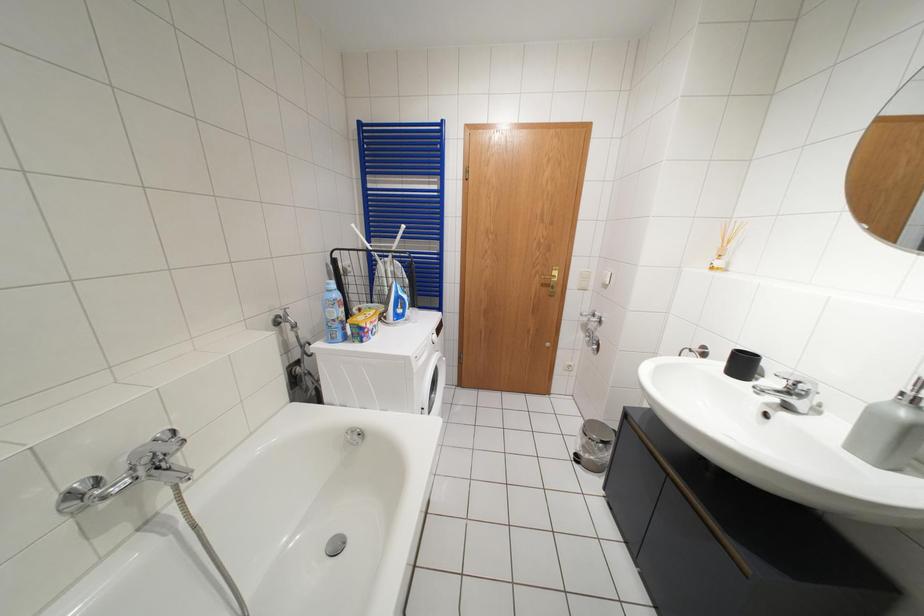
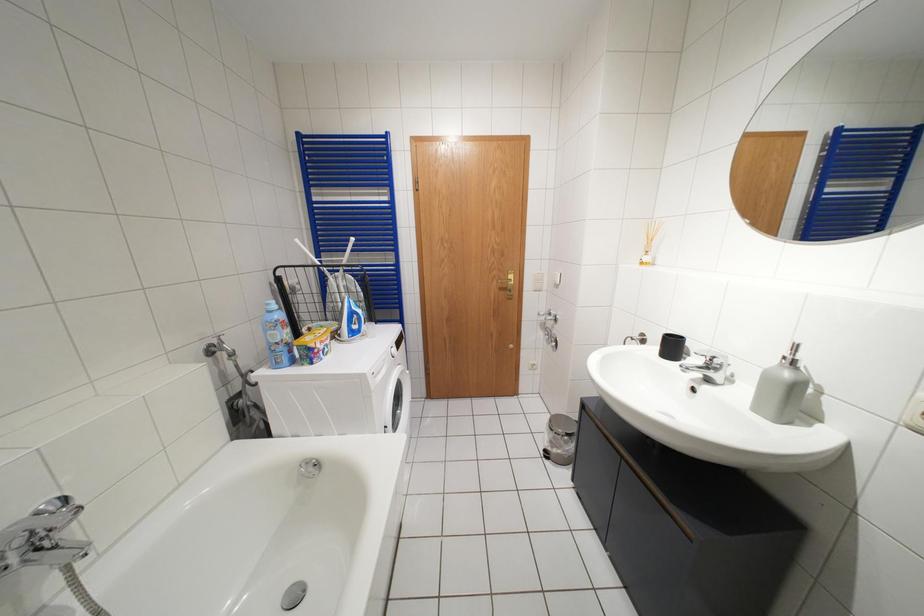
Question: The camera is either moving clockwise (left) or counter-clockwise (right) around the object. The first image is from the beginning of the video and the second image is from the end. Is the camera moving left or right when shooting the video?

Choices:
 (A) Left
 (B) Right

Answer: (A)